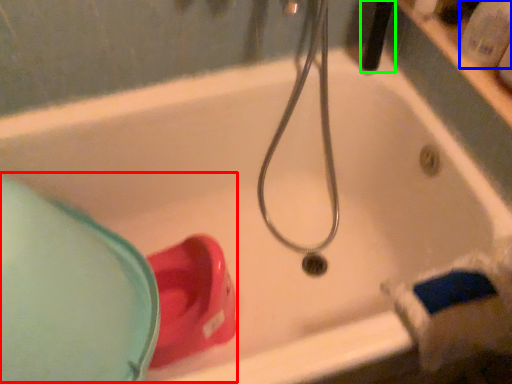
Question: Considering the real-world distances, which object is closest to sink (highlighted by a red box)? toiletry (highlighted by a blue box) or shower (highlighted by a green box).

Choices:
 (A) toiletry
 (B) shower

Answer: (B)